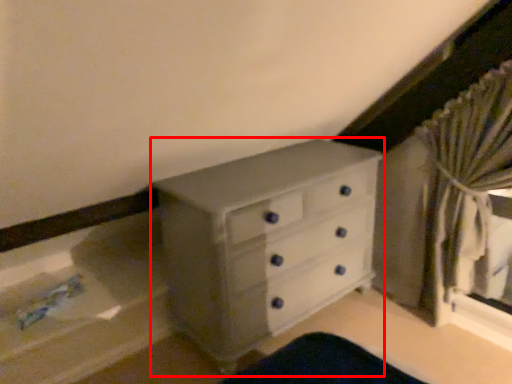
Question: In this image, where is chest of drawers (annotated by the red box) located relative to curtain?

Choices:
 (A) right
 (B) left

Answer: (B)